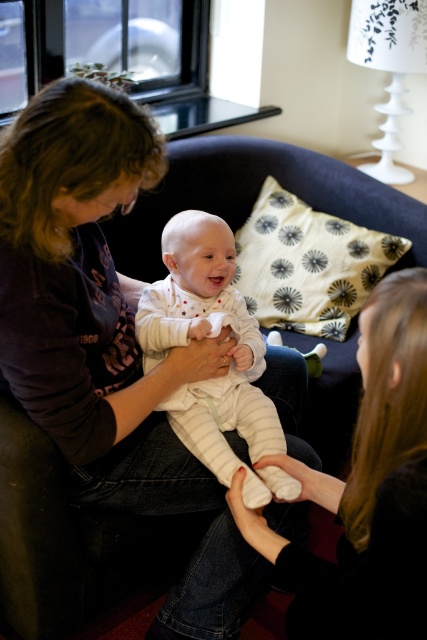
You are an interior designer planning to place a decorative item between the matte black shirt at center and the smooth black hair at upper right. Which object should you place closer to the wider one to ensure balance?

The matte black shirt at center might be wider than smooth black hair at upper right, so place the decorative item closer to the matte black shirt at center to maintain balance.

You are an interior designer analyzing the placement of objects in this living room. The sofa has a white decorative pillow with a black floral pattern. Where exactly is the matte black shirt at center located in relation to the sofa?

The matte black shirt at center is located at the 2D coordinates point (105, 339) in relation to the sofa.

You are a photographer trying to capture a candid shot of the baby in the living room. You notice the matte black shirt at center and the white striped onesie at center. Which clothing item should you focus on to ensure the baby is in the frame?

The matte black shirt at center is much taller than the white striped onesie at center, so focusing on the matte black shirt at center would ensure the baby is in the frame since it is positioned higher.